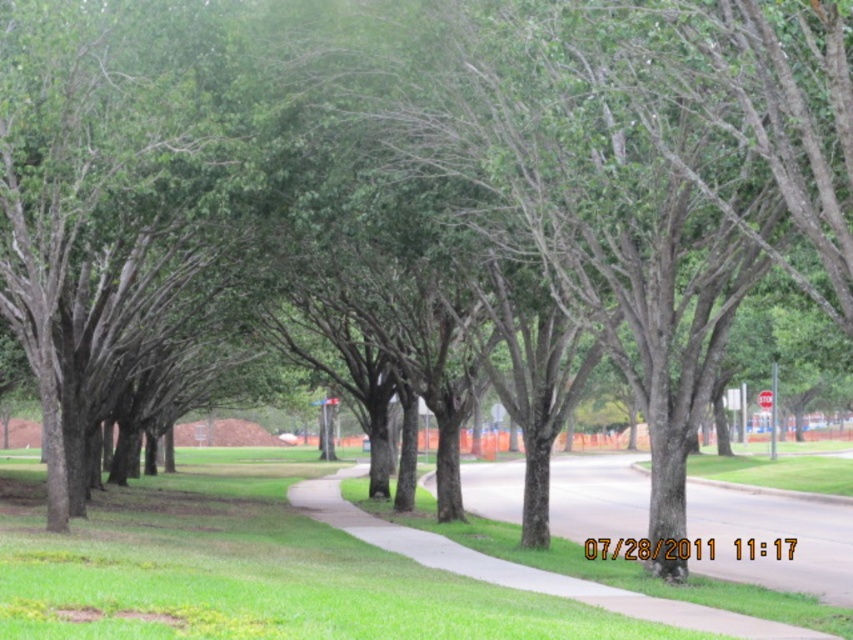
Who is positioned more to the right, green grass at center or gray asphalt pavement at center?

From the viewer's perspective, gray asphalt pavement at center appears more on the right side.

Does green grass at center appear over gray asphalt pavement at center?

Indeed, green grass at center is positioned over gray asphalt pavement at center.

Between point (79, 568) and point (804, 515), which one is positioned in front?

Point (79, 568) is in front.

Locate an element on the screen. Image resolution: width=853 pixels, height=640 pixels. green grass at center is located at coordinates (247, 572).